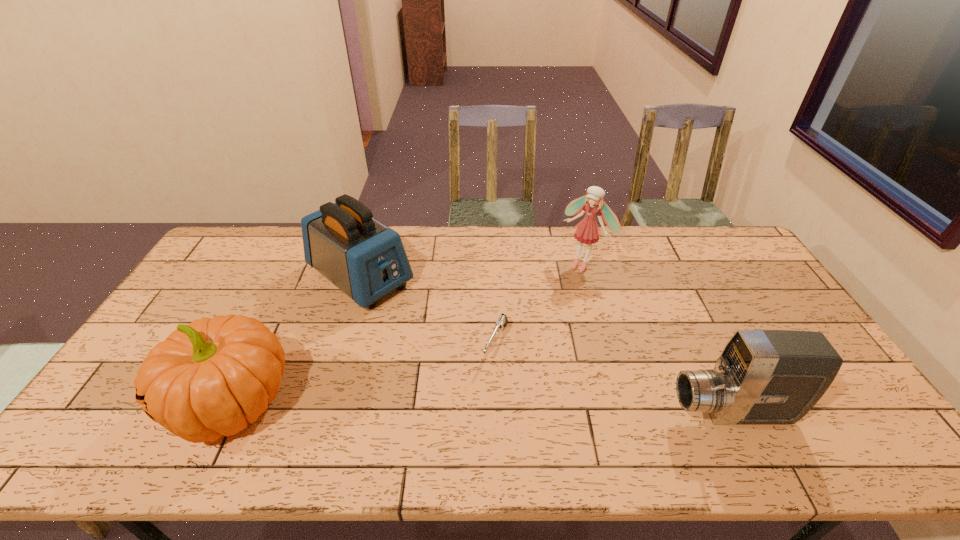
At what (x,y) coordinates should I click in order to perform the action: click on free spot on the desktop that is between the pumpkin and the rightmost object and is positioned on the front-facing side of the second object from right to left. Please return your answer as a coordinate pair (x, y). Image resolution: width=960 pixels, height=540 pixels. Looking at the image, I should click on (455, 408).

I want to click on vacant spot on the desktop that is between the pumpkin and the rightmost object and is positioned on the front-facing side of the third object from right to left, so click(x=464, y=408).

You are a GUI agent. You are given a task and a screenshot of the screen. Output one action in this format:
    pyautogui.click(x=<x>, y=<y>)
    Task: Click on the free space on the desktop that is between the pumpkin and the rightmost object and is positioned on the front-facing side of the toaster
    This screenshot has width=960, height=540.
    Given the screenshot: What is the action you would take?
    pyautogui.click(x=535, y=409)